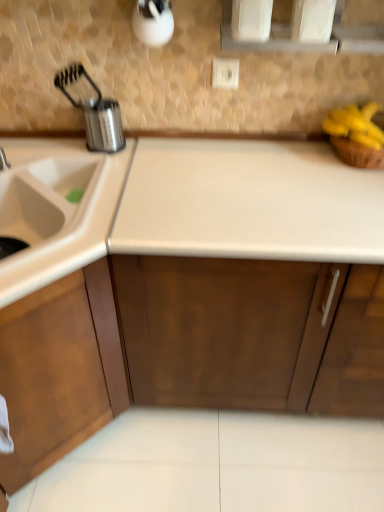
Image resolution: width=384 pixels, height=512 pixels. What do you see at coordinates (159, 426) in the screenshot?
I see `white laminate countertop at center` at bounding box center [159, 426].

Where is `yellow matte bananas at upper right`? yellow matte bananas at upper right is located at coordinates (356, 125).

This screenshot has height=512, width=384. Describe the element at coordinates (225, 73) in the screenshot. I see `white plastic electric outlet at upper center` at that location.

Measure the distance between point (218, 59) and camera.

Point (218, 59) and camera are 1.30 meters apart from each other.

This screenshot has width=384, height=512. I want to click on metallic silver canister at upper left, so click(94, 112).

This screenshot has width=384, height=512. Identify the location of white laminate countertop at center. (159, 426).

Considering the positions of points (64, 73) and (0, 158), is point (64, 73) closer to camera compared to point (0, 158)?

No, it is behind (0, 158).

Based on the photo, from a real-world perspective, who is located lower, metallic silver canister at upper left or brushed metal faucet at left?

In real-world perspective, brushed metal faucet at left is lower.

Is brushed metal faucet at left at the back of metallic silver canister at upper left?

No, brushed metal faucet at left is not at the back of metallic silver canister at upper left.

You are a GUI agent. You are given a task and a screenshot of the screen. Output one action in this format:
    pyautogui.click(x=<x>, y=<y>)
    Task: Click on the banana on the right of the white laminate countertop at center
    The height and width of the screenshot is (512, 384).
    Given the screenshot: What is the action you would take?
    pyautogui.click(x=356, y=125)

Considering the sizes of white laminate countertop at center and yellow matte bananas at upper right in the image, is white laminate countertop at center bigger or smaller than yellow matte bananas at upper right?

white laminate countertop at center is bigger than yellow matte bananas at upper right.

From the image's perspective, is white laminate countertop at center over yellow matte bananas at upper right?

No, from the image's perspective, white laminate countertop at center is not on top of yellow matte bananas at upper right.

Considering the sizes of white laminate countertop at center and yellow matte bananas at upper right in the image, is white laminate countertop at center taller or shorter than yellow matte bananas at upper right?

white laminate countertop at center is taller than yellow matte bananas at upper right.

Is point (115, 316) farther from camera compared to point (120, 116)?

No, (115, 316) is closer to viewer.

Measure the distance from wooden cabinet at left to metallic silver canister at upper left.

The distance of wooden cabinet at left from metallic silver canister at upper left is 26.40 inches.

From the image's perspective, is wooden cabinet at left above metallic silver canister at upper left?

No, from the image's perspective, wooden cabinet at left is not on top of metallic silver canister at upper left.

From a real-world perspective, is wooden cabinet at left above or below metallic silver canister at upper left?

wooden cabinet at left is below metallic silver canister at upper left.

From a real-world perspective, between yellow matte bananas at upper right and metallic silver canister at upper left, who is vertically higher?

metallic silver canister at upper left.

Is yellow matte bananas at upper right next to metallic silver canister at upper left?

yellow matte bananas at upper right and metallic silver canister at upper left are not in contact.

Is yellow matte bananas at upper right thinner than metallic silver canister at upper left?

No.

From the image's perspective, who appears lower, yellow matte bananas at upper right or metallic silver canister at upper left?

yellow matte bananas at upper right, from the image's perspective.

Is brushed metal faucet at left situated inside yellow matte bananas at upper right or outside?

brushed metal faucet at left is outside yellow matte bananas at upper right.

Are brushed metal faucet at left and yellow matte bananas at upper right making contact?

They are not placed beside each other.

Can you tell me how much brushed metal faucet at left and yellow matte bananas at upper right differ in facing direction?

They differ by 38.2 degrees in their facing directions.

From a real-world perspective, is brushed metal faucet at left physically located above or below yellow matte bananas at upper right?

Clearly, from a real-world perspective, brushed metal faucet at left is below yellow matte bananas at upper right.

Based on their positions, is white plastic electric outlet at upper center located to the left or right of wooden cabinet at left?

Based on their positions, white plastic electric outlet at upper center is located to the right of wooden cabinet at left.

Does white plastic electric outlet at upper center have a larger size compared to wooden cabinet at left?

No, white plastic electric outlet at upper center is not bigger than wooden cabinet at left.

Considering the sizes of objects white plastic electric outlet at upper center and wooden cabinet at left in the image provided, who is shorter, white plastic electric outlet at upper center or wooden cabinet at left?

white plastic electric outlet at upper center is shorter.

Is white plastic electric outlet at upper center spatially inside wooden cabinet at left, or outside of it?

The correct answer is: outside.

Considering the relative sizes of wooden cabinet at left and yellow matte bananas at upper right in the image provided, is wooden cabinet at left taller than yellow matte bananas at upper right?

Yes, wooden cabinet at left is taller than yellow matte bananas at upper right.

Can you confirm if wooden cabinet at left is positioned to the left of yellow matte bananas at upper right?

Yes.

In order to click on banana located above the wooden cabinet at left (from the image's perspective) in this screenshot , I will do `click(356, 125)`.

Identify the location of tap below the metallic silver canister at upper left (from a real-world perspective). (3, 160).

I want to click on banana positioned vertically above the white laminate countertop at center (from a real-world perspective), so click(356, 125).

Based on their spatial positions, is white laminate countertop at center or yellow matte bananas at upper right further from white plastic electric outlet at upper center?

Among the two, white laminate countertop at center is located further to white plastic electric outlet at upper center.

From the image, which object appears to be nearer to brushed metal faucet at left, yellow matte bananas at upper right or wooden cabinet at left?

wooden cabinet at left.

When comparing their distances from metallic silver canister at upper left, does brushed metal faucet at left or white laminate countertop at center seem further?

white laminate countertop at center lies further to metallic silver canister at upper left than the other object.

Estimate the real-world distances between objects in this image. Which object is closer to white laminate countertop at center, wooden cabinet at left or metallic silver canister at upper left?

The object closer to white laminate countertop at center is wooden cabinet at left.

From the image, which object appears to be farther from wooden cabinet at left, yellow matte bananas at upper right or white laminate countertop at center?

The object further to wooden cabinet at left is yellow matte bananas at upper right.

Looking at the image, which one is located closer to white plastic electric outlet at upper center, wooden cabinet at left or brushed metal faucet at left?

brushed metal faucet at left lies closer to white plastic electric outlet at upper center than the other object.

Which object lies nearer to the anchor point brushed metal faucet at left, white laminate countertop at center or metallic silver canister at upper left?

metallic silver canister at upper left is positioned closer to the anchor brushed metal faucet at left.

Based on their spatial positions, is white laminate countertop at center or white plastic electric outlet at upper center closer to yellow matte bananas at upper right?

white plastic electric outlet at upper center lies closer to yellow matte bananas at upper right than the other object.

Find the location of a particular element. appliance between wooden cabinet at left and white laminate countertop at center in the horizontal direction is located at coordinates (94, 112).

At what (x,y) coordinates should I click in order to perform the action: click on banana between white plastic electric outlet at upper center and white laminate countertop at center from top to bottom. Please return your answer as a coordinate pair (x, y). The width and height of the screenshot is (384, 512). Looking at the image, I should click on point(356,125).

You are a GUI agent. You are given a task and a screenshot of the screen. Output one action in this format:
    pyautogui.click(x=<x>, y=<y>)
    Task: Click on the tap between metallic silver canister at upper left and wooden cabinet at left from top to bottom
    
    Given the screenshot: What is the action you would take?
    pyautogui.click(x=3, y=160)

Where is `appliance between brushed metal faucet at left and white laminate countertop at center`? The image size is (384, 512). appliance between brushed metal faucet at left and white laminate countertop at center is located at coordinates (94, 112).